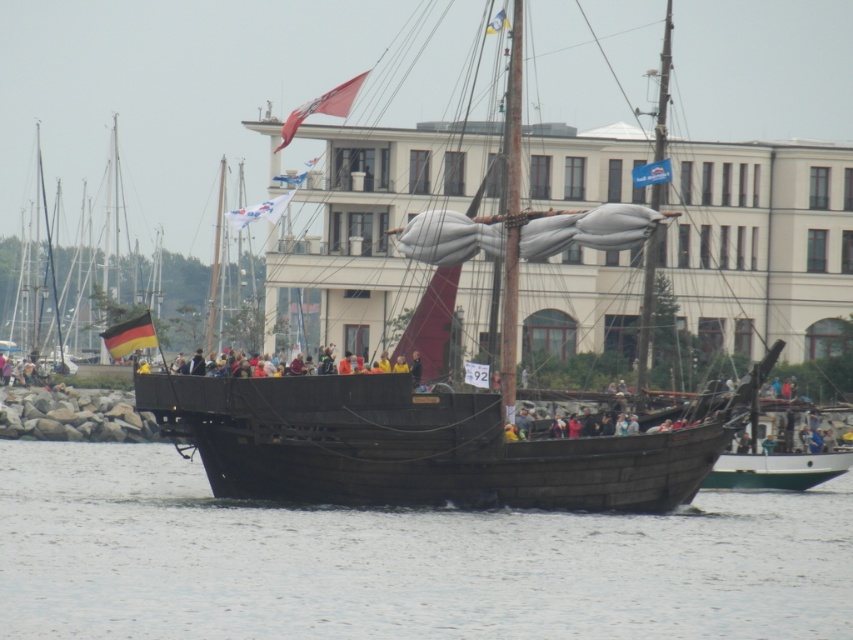
You are a sailor on a small boat approaching the wooden pirate ship at center. You notice a red fabric flag at upper center flying high above. Considering the distance between your boat and the flag, can you safely navigate under the flag without hitting it?

The distance between the wooden pirate ship at center and the red fabric flag at upper center is 244.10 feet. Since your boat is approaching the ship, the flag is 244.10 feet away from the ship, so there should be enough space to safely navigate under it without collision.

You are a sailor on the ship and need to determine the position of the flags. Which flag is closer to you, the white fabric flag at center or the yellow fabric flag at upper center?

The white fabric flag at center is closer to you because it is further to the viewer than the yellow fabric flag at upper center.